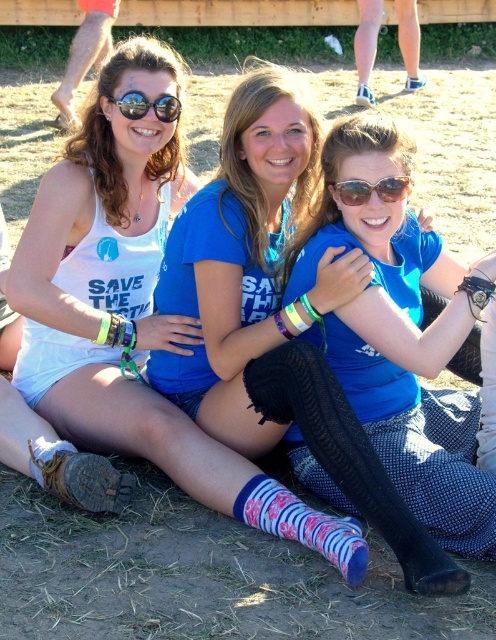
How distant is striped cotton socks at lower center from black reflective sunglasses at upper center?

A distance of 7.59 feet exists between striped cotton socks at lower center and black reflective sunglasses at upper center.

At what (x,y) coordinates should I click in order to perform the action: click on striped cotton socks at lower center. Please return your answer as a coordinate pair (x, y). This screenshot has height=640, width=496. Looking at the image, I should click on (303, 524).

Which of these two, striped cotton socks at center or striped cotton socks at lower center, stands taller?

With more height is striped cotton socks at center.

Which is above, striped cotton socks at center or striped cotton socks at lower center?

striped cotton socks at center

At what (x,y) coordinates should I click in order to perform the action: click on striped cotton socks at center. Please return your answer as a coordinate pair (x, y). This screenshot has height=640, width=496. Looking at the image, I should click on (x=348, y=458).

Find the location of a particular element. The width and height of the screenshot is (496, 640). striped cotton socks at center is located at coordinates (348, 458).

Does striped cotton socks at center have a larger size compared to brown suede boot at lower left?

Yes.

Measure the distance from striped cotton socks at center to brown suede boot at lower left.

striped cotton socks at center is 3.58 feet from brown suede boot at lower left.

The height and width of the screenshot is (640, 496). In order to click on striped cotton socks at center in this screenshot , I will do `click(348, 458)`.